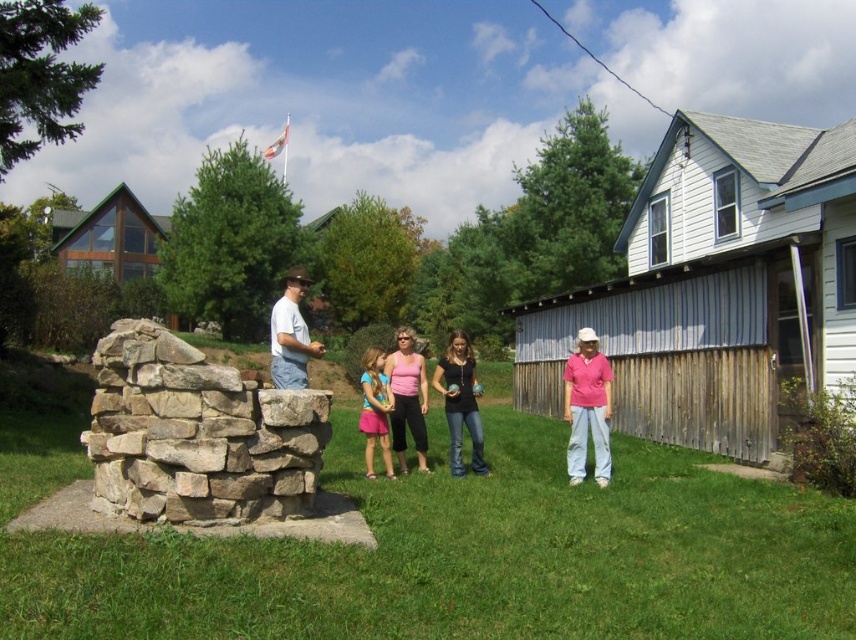
Looking at this image, you are standing at the origin point in the image. Where is the pink cotton shirt at center located in terms of coordinates?

The pink cotton shirt at center is located at coordinates point (461,401).

You are standing at the camera position and want to take a photo of the natural stone fountain at center. The recommended minimum distance for sharp focus is 5 meters. Will the fountain be in focus?

The natural stone fountain at center is 5.13 meters away from camera, which is beyond the recommended minimum distance of 5 meters for sharp focus. Therefore, the fountain will be in focus.

You are standing in the grassy yard and want to locate the natural stone fountain at center. According to the coordinates provided, where should you look relative to the center of the image?

The natural stone fountain at center is located at coordinates point (195, 435), which is to the right and slightly below the center of the image.